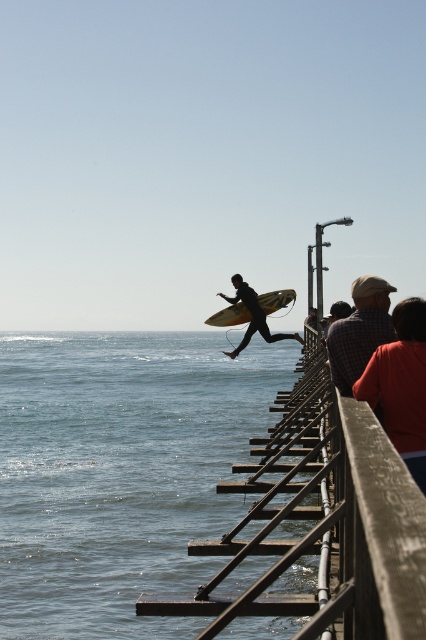
Question: Considering the real-world distances, which object is farthest from the silhouette surfboard at center?

Choices:
 (A) clear blue water at lower left
 (B) plaid shirt at center
 (C) wooden surfboard at center

Answer: (A)

Question: Is clear blue water at lower left above wooden surfboard at center?

Choices:
 (A) yes
 (B) no

Answer: (B)

Question: In this image, where is silhouette surfboard at center located relative to wooden surfboard at center?

Choices:
 (A) below
 (B) above

Answer: (A)

Question: Which object is positioned closest to the silhouette surfboard at center?

Choices:
 (A) clear blue water at lower left
 (B) plaid shirt at center

Answer: (B)

Question: Which object is the closest to the wooden surfboard at center?

Choices:
 (A) clear blue water at lower left
 (B) silhouette surfboard at center
 (C) plaid shirt at center

Answer: (B)

Question: Does clear blue water at lower left have a smaller size compared to silhouette surfboard at center?

Choices:
 (A) yes
 (B) no

Answer: (B)